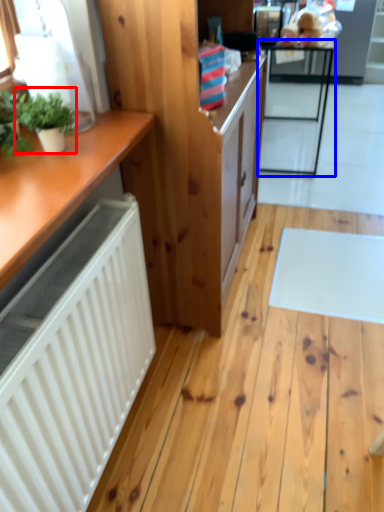
Question: Among these objects, which one is nearest to the camera, houseplant (highlighted by a red box) or table (highlighted by a blue box)?

Choices:
 (A) houseplant
 (B) table

Answer: (A)